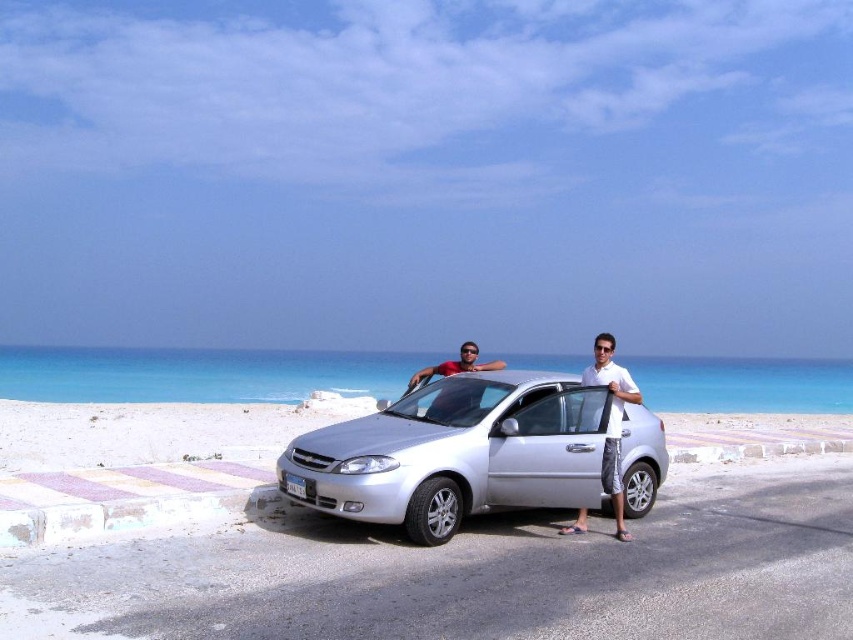
Question: Which of the following is the farthest from the observer?

Choices:
 (A) matte black car at center
 (B) white cotton shirt at center
 (C) silver metallic car at center

Answer: (A)

Question: Is silver metallic car at center to the right of matte black car at center from the viewer's perspective?

Choices:
 (A) no
 (B) yes

Answer: (B)

Question: Is white cotton shirt at center above matte black car at center?

Choices:
 (A) yes
 (B) no

Answer: (B)

Question: Where is silver metallic car at center located in relation to matte black car at center in the image?

Choices:
 (A) right
 (B) left

Answer: (A)

Question: Which of the following is the farthest from the observer?

Choices:
 (A) white cotton shirt at center
 (B) matte black car at center

Answer: (B)

Question: Which of the following is the closest to the observer?

Choices:
 (A) (590, 436)
 (B) (607, 454)
 (C) (467, 358)

Answer: (B)